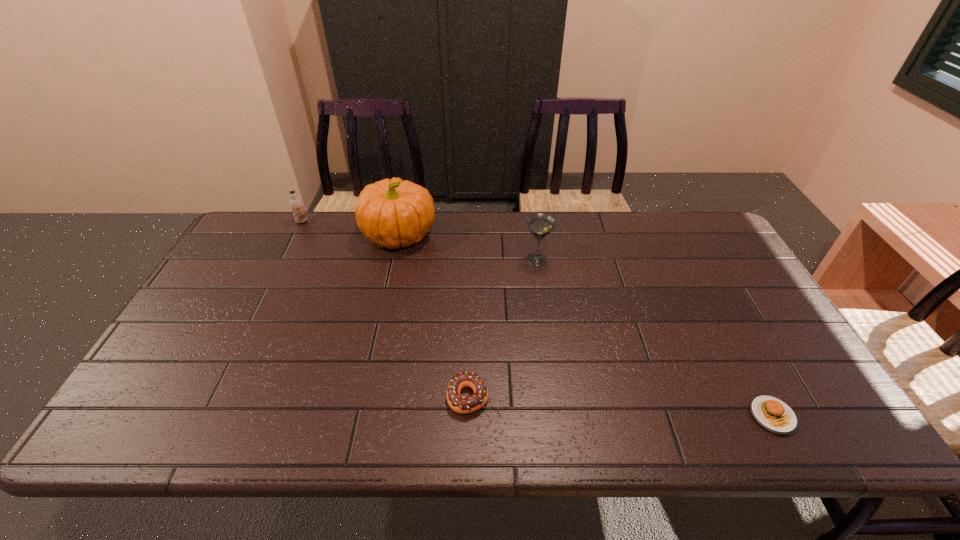
Identify the location of object positioned at the left edge. The width and height of the screenshot is (960, 540). [296, 204].

This screenshot has height=540, width=960. In order to click on object that is at the right edge in this screenshot , I will do `click(773, 414)`.

You are a GUI agent. You are given a task and a screenshot of the screen. Output one action in this format:
    pyautogui.click(x=<x>, y=<y>)
    Task: Click on the object positioned at the far left corner
    The height and width of the screenshot is (540, 960).
    Given the screenshot: What is the action you would take?
    pyautogui.click(x=296, y=204)

Identify the location of object positioned at the near right corner. This screenshot has height=540, width=960. (773, 414).

Where is `vacant space at the far edge of the desktop`? vacant space at the far edge of the desktop is located at coordinates (616, 246).

In the image, there is a desktop. Where is `vacant space at the near edge`? The image size is (960, 540). vacant space at the near edge is located at coordinates (540, 420).

The height and width of the screenshot is (540, 960). In the image, there is a desktop. Identify the location of blank space at the left edge. (197, 325).

Locate an element on the screen. The width and height of the screenshot is (960, 540). vacant space at the right edge is located at coordinates [x=784, y=366].

This screenshot has width=960, height=540. Identify the location of vacant area at the near left corner. (134, 412).

In the image, there is a desktop. What are the coordinates of `free space at the far right corner` in the screenshot? It's located at (695, 237).